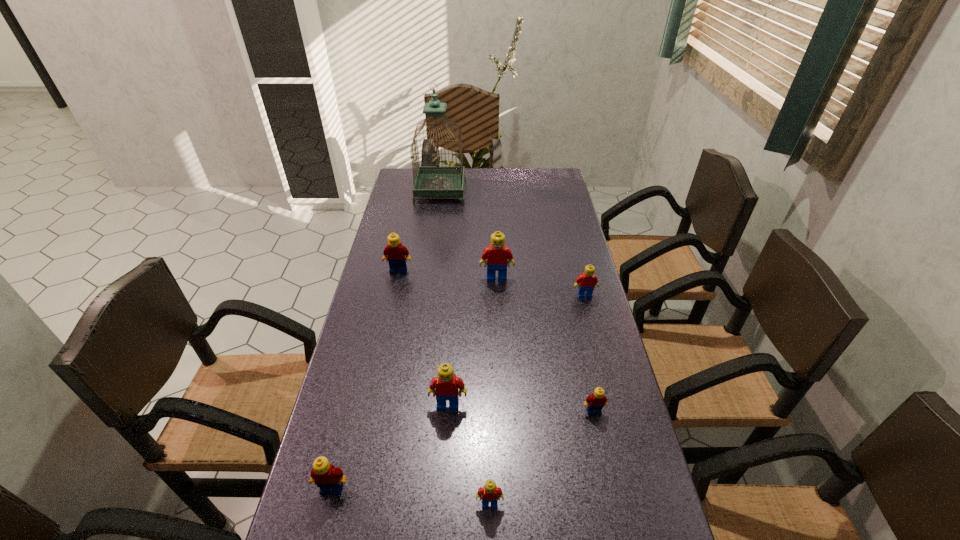
Where is `vacant space located 0.050m on the front-facing side of the sixth farthest Lego`? Image resolution: width=960 pixels, height=540 pixels. vacant space located 0.050m on the front-facing side of the sixth farthest Lego is located at coordinates (324, 521).

What are the coordinates of `free spot located 0.220m on the front-facing side of the rightmost yellow Lego` in the screenshot? It's located at (615, 510).

The image size is (960, 540). Identify the location of object at the far edge. pos(430,181).

Locate an element on the screen. This screenshot has width=960, height=540. birdcage that is at the left edge is located at coordinates pos(430,181).

At what (x,y) coordinates should I click in order to perform the action: click on object situated at the far left corner. Please return your answer as a coordinate pair (x, y). The height and width of the screenshot is (540, 960). Looking at the image, I should click on (430, 181).

Locate an element on the screen. This screenshot has width=960, height=540. vacant point at the far edge is located at coordinates (470, 177).

This screenshot has width=960, height=540. I want to click on vacant space at the left edge of the desktop, so click(x=414, y=240).

What are the coordinates of `free space at the right edge` in the screenshot? It's located at (532, 204).

At what (x,y) coordinates should I click in order to perform the action: click on free space at the far left corner of the desktop. Please return your answer as a coordinate pair (x, y). The height and width of the screenshot is (540, 960). Looking at the image, I should click on (411, 183).

In the image, there is a desktop. At what (x,y) coordinates should I click in order to perform the action: click on vacant space at the far right corner. Please return your answer as a coordinate pair (x, y). The image size is (960, 540). Looking at the image, I should click on (546, 190).